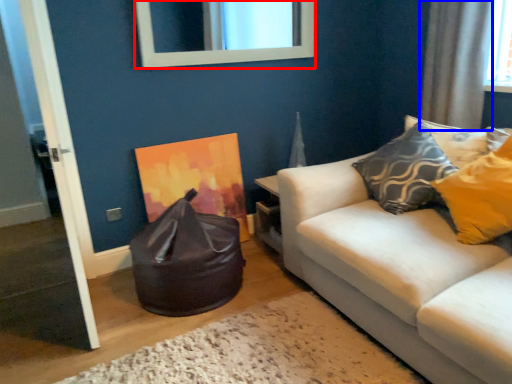
Question: Among these objects, which one is farthest to the camera, mirror (highlighted by a red box) or curtain (highlighted by a blue box)?

Choices:
 (A) mirror
 (B) curtain

Answer: (A)